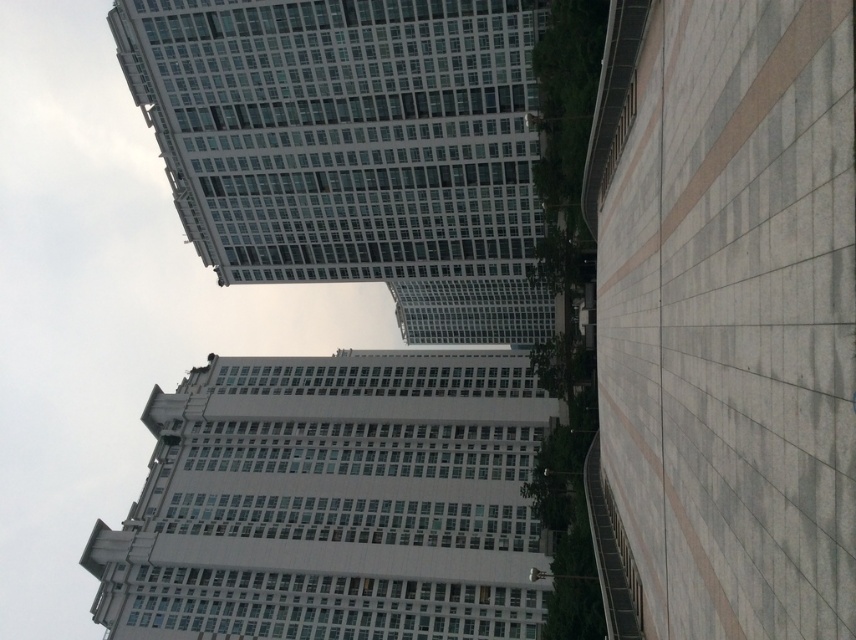
You are a city planner assessing the urban layout. You need to determine if the white smooth sidewalk at right can accommodate a temporary 5m wide pedestrian market. Given the white smooth building at center is 20 meters wide, what is your recommendation?

The white smooth sidewalk at right has a width less than the white smooth building at center, which is 20 meters wide. Since the sidewalk is narrower than the building, it may not have sufficient space for a 5m wide pedestrian market. Consider alternative locations with wider pathways.

You are a city planner analyzing the urban layout. You need to determine if the white smooth sidewalk at right can accommodate a new bench that requires a minimum width of 2 meters. Given the white glass building at upper center is 20 meters wide, can the sidewalk support the bench?

The white smooth sidewalk at right is thinner than the white glass building at upper center, which is 20 meters wide. Since the sidewalk is narrower, it may not meet the 2 meter width requirement for the bench. Check the sidewalk dimensions before installing.

You are a delivery drone with a wingspan of 1.2 meters. You need to fly from the white smooth sidewalk at right to the white glass building at upper center. Is there enough space between them for your drone to safely navigate?

The distance between the white smooth sidewalk at right and the white glass building at upper center is 50.56 meters, which is more than sufficient for the drone to navigate safely as its wingspan is only 1.2 meters. The drone can easily maneuver the space between them without any issues.